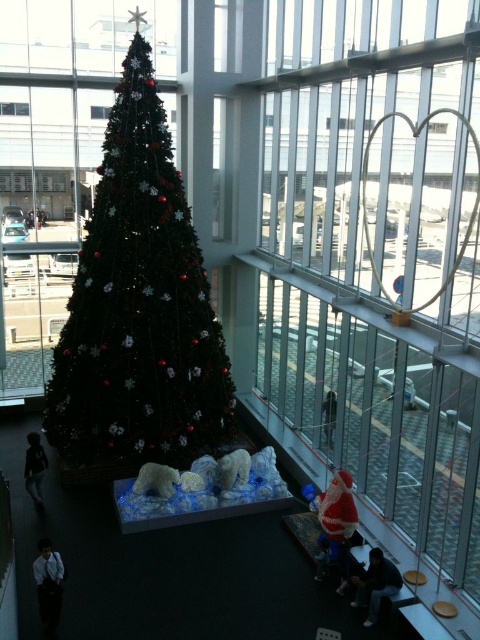
Question: Which point is closer to the camera taking this photo?

Choices:
 (A) (337, 513)
 (B) (151, 316)
 (C) (144, 465)
 (D) (34, 467)

Answer: (A)

Question: Can you confirm if white plush bear at center is positioned below dark gray fabric person at center?

Choices:
 (A) no
 (B) yes

Answer: (B)

Question: From the image, what is the correct spatial relationship of dark blue shirt at lower left in relation to dark gray sweater at lower left?

Choices:
 (A) above
 (B) below

Answer: (B)

Question: Which object is the farthest from the shiny green christmas tree at center?

Choices:
 (A) dark gray fabric person at center
 (B) fluffy white bear at center

Answer: (A)

Question: Which point appears farthest from the camera in this image?

Choices:
 (A) (37, 580)
 (B) (332, 496)

Answer: (B)

Question: Can you confirm if white plush bear at center is positioned below dark gray fabric person at center?

Choices:
 (A) yes
 (B) no

Answer: (A)